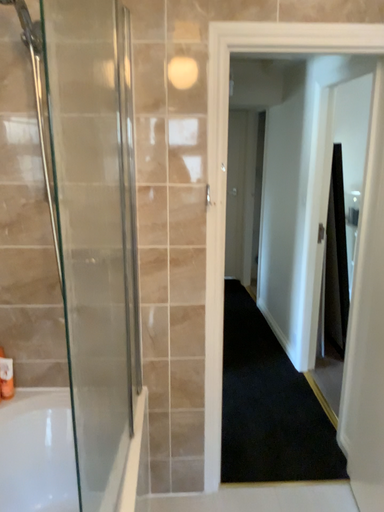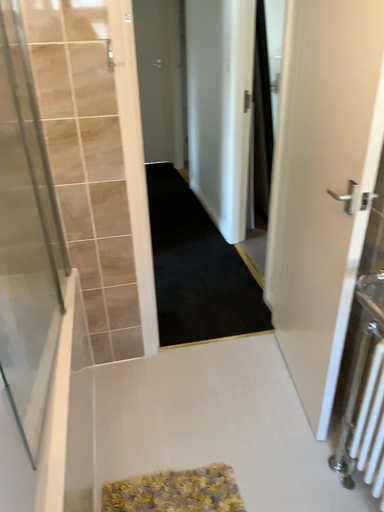
Question: Which way did the camera rotate in the video?

Choices:
 (A) rotated right
 (B) rotated left

Answer: (A)